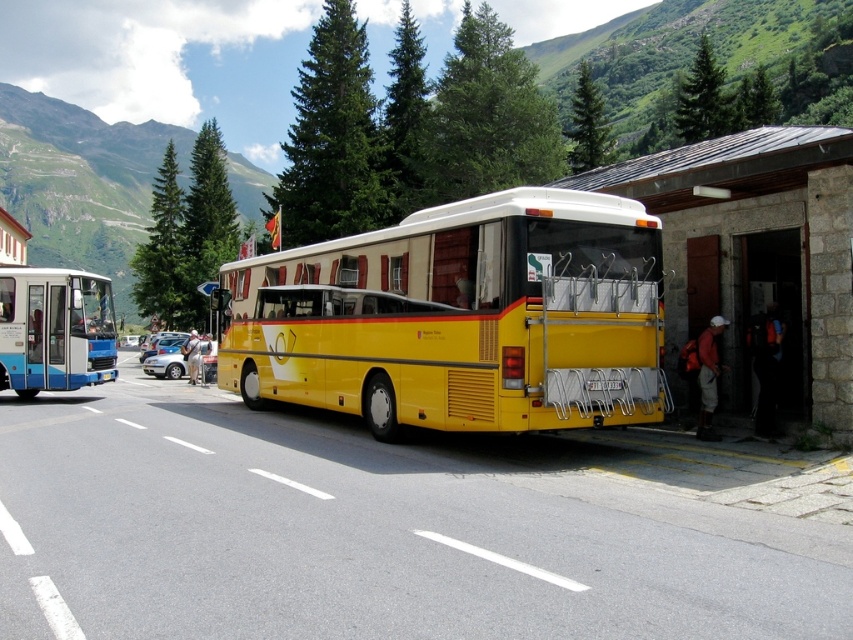
You are standing at the bus stop and want to board the yellow matte bus at center. If your walking speed is 1.2 meters per second, how many seconds will it take you to reach the bus?

The yellow matte bus at center is 8.93 meters away from the viewer. At a walking speed of 1.2 meters per second, it would take approximately 7.44 seconds to reach the bus.